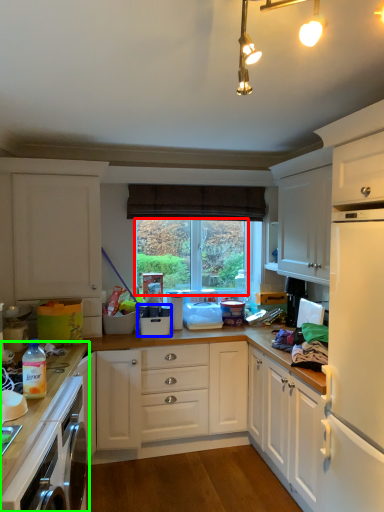
Question: Considering the real-world distances, which object is farthest from window screen (highlighted by a red box)? appliance (highlighted by a blue box) or countertop (highlighted by a green box)?

Choices:
 (A) appliance
 (B) countertop

Answer: (B)